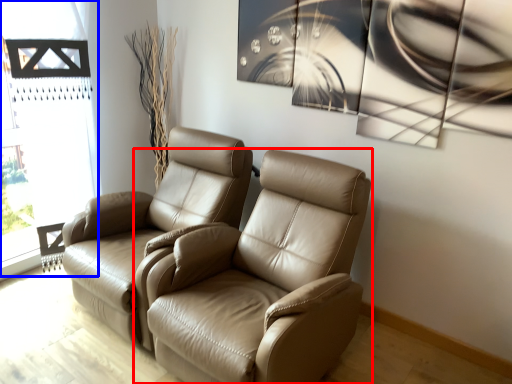
Question: Among these objects, which one is nearest to the camera, chair (highlighted by a red box) or window frame (highlighted by a blue box)?

Choices:
 (A) chair
 (B) window frame

Answer: (A)